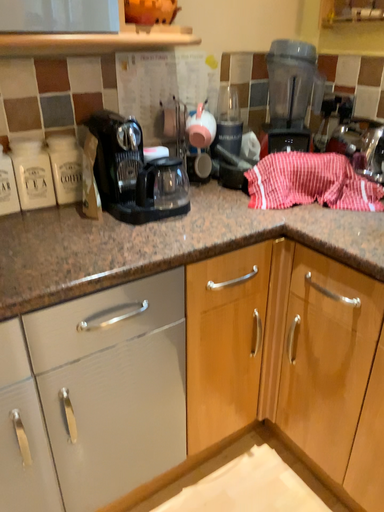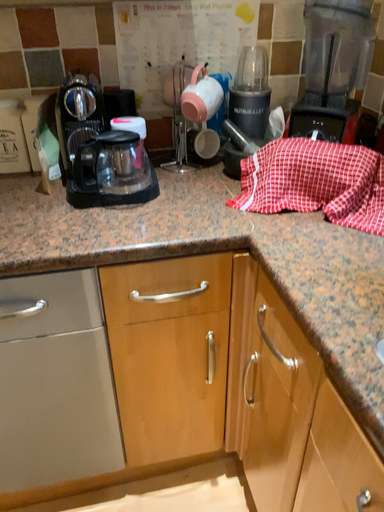
Question: How did the camera likely rotate when shooting the video?

Choices:
 (A) rotated right
 (B) rotated left

Answer: (B)